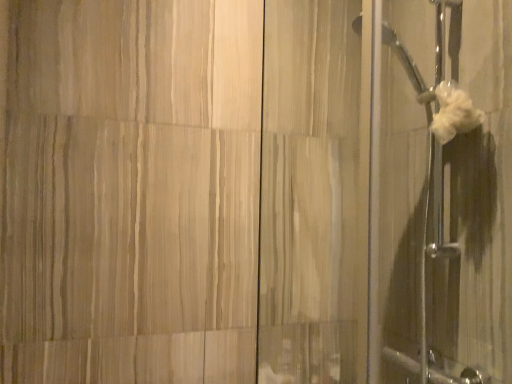
This screenshot has height=384, width=512. Describe the element at coordinates (441, 193) in the screenshot. I see `white fabric at right` at that location.

You are a GUI agent. You are given a task and a screenshot of the screen. Output one action in this format:
    pyautogui.click(x=<x>, y=<y>)
    Task: Click on the white fabric at right
    The height and width of the screenshot is (384, 512).
    Given the screenshot: What is the action you would take?
    pyautogui.click(x=441, y=193)

This screenshot has width=512, height=384. I want to click on white fluffy towel at upper right, so click(x=454, y=113).

What do you see at coordinates (454, 113) in the screenshot? I see `white fluffy towel at upper right` at bounding box center [454, 113].

You are a GUI agent. You are given a task and a screenshot of the screen. Output one action in this format:
    pyautogui.click(x=<x>, y=<y>)
    Task: Click on the white fabric at right
    The image size is (512, 384).
    Given the screenshot: What is the action you would take?
    pyautogui.click(x=441, y=193)

Considering the positions of objects white fabric at right and white fluffy towel at upper right in the image provided, who is more to the right, white fabric at right or white fluffy towel at upper right?

Positioned to the right is white fluffy towel at upper right.

Is the position of white fabric at right more distant than that of white fluffy towel at upper right?

No, it is not.

Between point (436, 147) and point (468, 118), which one is positioned in front?

Positioned in front is point (468, 118).

From the image's perspective, is white fabric at right located above or below white fluffy towel at upper right?

white fabric at right is below white fluffy towel at upper right.

From a real-world perspective, does white fabric at right sit lower than white fluffy towel at upper right?

Correct, in the physical world, white fabric at right is lower than white fluffy towel at upper right.

Considering the sizes of objects white fabric at right and white fluffy towel at upper right in the image provided, who is thinner, white fabric at right or white fluffy towel at upper right?

white fluffy towel at upper right.

Can you confirm if white fabric at right is shorter than white fluffy towel at upper right?

No, white fabric at right is not shorter than white fluffy towel at upper right.

Does white fabric at right have a smaller size compared to white fluffy towel at upper right?

Actually, white fabric at right might be larger than white fluffy towel at upper right.

Is white fluffy towel at upper right surrounded by white fabric at right?

Yes, white fluffy towel at upper right is a part of white fabric at right.

Looking at this image, would you say white fabric at right is a long distance from white fluffy towel at upper right?

They are positioned close to each other.

Is white fabric at right turned away from white fluffy towel at upper right?

Absolutely, white fabric at right is directed away from white fluffy towel at upper right.

How many degrees apart are the facing directions of white fabric at right and white fluffy towel at upper right?

3.9 degrees separate the facing orientations of white fabric at right and white fluffy towel at upper right.

Measure the distance between white fabric at right and white fluffy towel at upper right.

white fabric at right and white fluffy towel at upper right are 24.20 centimeters apart from each other.

There is a white fabric at right. Where is `flower above it (from a real-world perspective)`? The height and width of the screenshot is (384, 512). flower above it (from a real-world perspective) is located at coordinates (454, 113).

Which object is positioned more to the right, white fluffy towel at upper right or white fabric at right?

white fluffy towel at upper right.

Between white fluffy towel at upper right and white fabric at right, which one is positioned behind?

white fluffy towel at upper right is further away from the camera.

Considering the positions of points (437, 131) and (397, 86), is point (437, 131) farther from camera compared to point (397, 86)?

No, it is not.

From the image's perspective, between white fluffy towel at upper right and white fabric at right, who is located below?

white fabric at right.

From a real-world perspective, between white fluffy towel at upper right and white fabric at right, who is vertically lower?

From a 3D spatial view, white fabric at right is below.

Can you confirm if white fluffy towel at upper right is wider than white fabric at right?

No, white fluffy towel at upper right is not wider than white fabric at right.

Who is taller, white fluffy towel at upper right or white fabric at right?

Answer: white fabric at right.

From the picture: Considering the relative sizes of white fluffy towel at upper right and white fabric at right in the image provided, is white fluffy towel at upper right smaller than white fabric at right?

Yes, white fluffy towel at upper right is smaller than white fabric at right.

Is white fabric at right a part of white fluffy towel at upper right?

No, white fabric at right is not a part of white fluffy towel at upper right.

Is white fluffy towel at upper right not close to white fabric at right?

No, white fluffy towel at upper right is not far away from white fabric at right.

Does white fluffy towel at upper right turn towards white fabric at right?

Yes, white fluffy towel at upper right is facing white fabric at right.

Measure the distance between white fluffy towel at upper right and white fabric at right.

They are 9.53 inches apart.

Find the location of `flower that is above the white fabric at right (from the image's perspective)`. flower that is above the white fabric at right (from the image's perspective) is located at coordinates (454, 113).

There is a white fabric at right. What are the coordinates of `flower above it (from a real-world perspective)` in the screenshot? It's located at (454, 113).

At what (x,y) coordinates should I click in order to perform the action: click on flower lying behind the white fabric at right. Please return your answer as a coordinate pair (x, y). Image resolution: width=512 pixels, height=384 pixels. Looking at the image, I should click on coord(454,113).